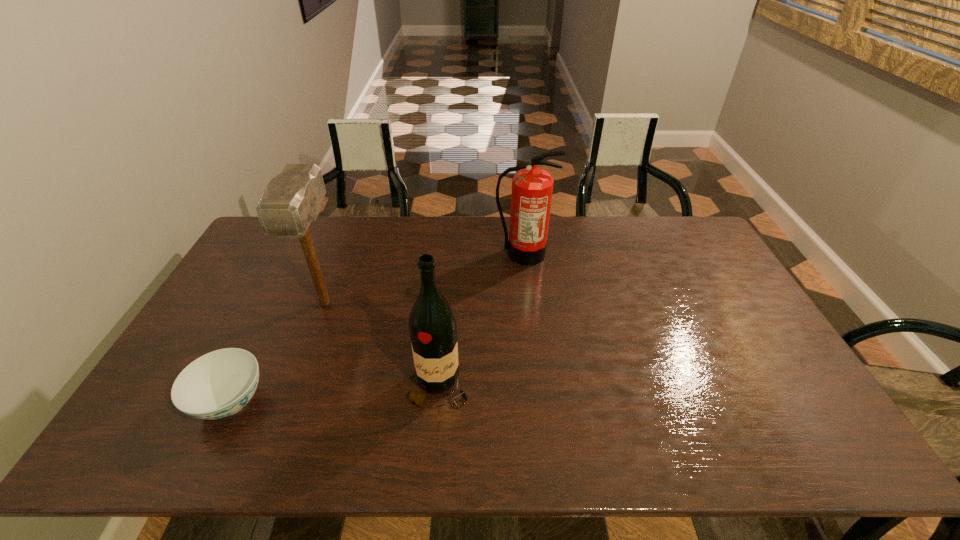
You are a GUI agent. You are given a task and a screenshot of the screen. Output one action in this format:
    pyautogui.click(x=<x>, y=<y>)
    Task: Click on the free spot located on the right of the chinaware
    The height and width of the screenshot is (540, 960).
    Given the screenshot: What is the action you would take?
    pyautogui.click(x=429, y=402)

Identify the location of object located in the far edge section of the desktop. (532, 187).

The width and height of the screenshot is (960, 540). Find the location of `object at the near edge`. object at the near edge is located at coordinates (218, 384).

The image size is (960, 540). Find the location of `object that is positioned at the left edge`. object that is positioned at the left edge is located at coordinates (218, 384).

The width and height of the screenshot is (960, 540). I want to click on object located in the near left corner section of the desktop, so click(x=218, y=384).

The image size is (960, 540). In order to click on free location at the far edge of the desktop in this screenshot , I will do tap(317, 222).

The width and height of the screenshot is (960, 540). In the image, there is a desktop. Find the location of `vacant space at the near edge`. vacant space at the near edge is located at coordinates tap(741, 456).

This screenshot has height=540, width=960. I want to click on vacant space at the left edge of the desktop, so click(x=248, y=328).

This screenshot has width=960, height=540. I want to click on free space at the right edge of the desktop, so click(684, 265).

This screenshot has width=960, height=540. In order to click on empty location between the fire extinguisher and the second object from right to left in this screenshot , I will do `click(481, 320)`.